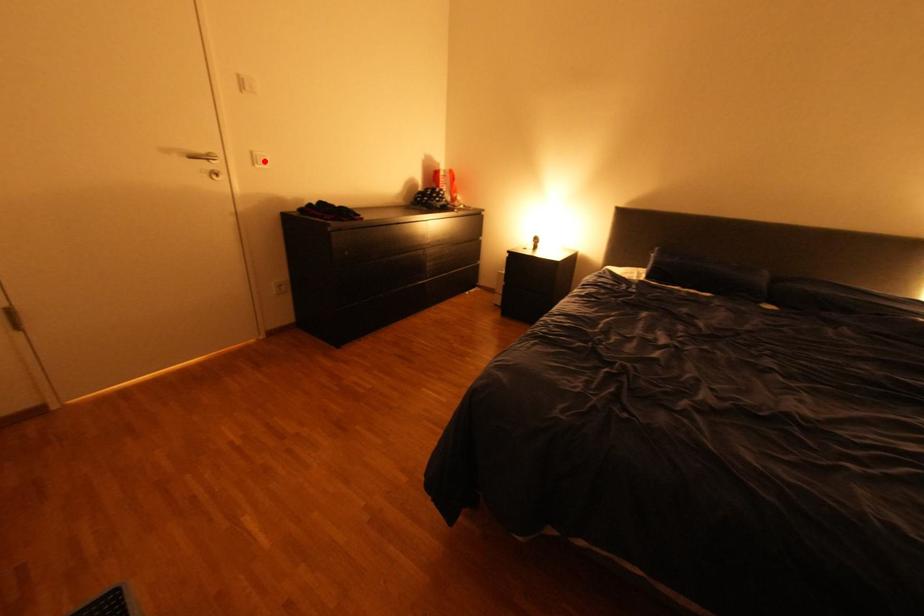
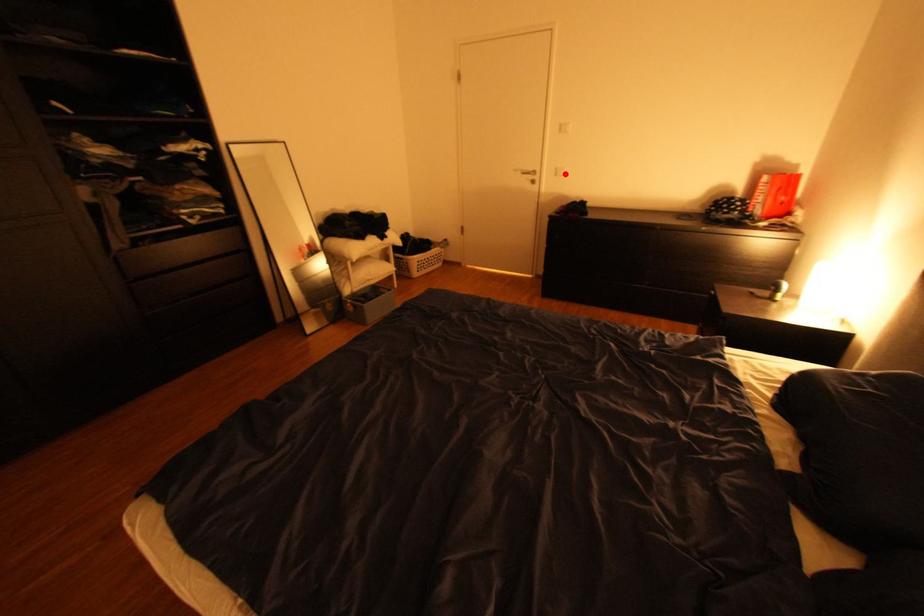
I am providing you with two images of the same scene from different viewpoints. A red point is marked on the first image and another point is marked on the second image. Is the marked point in image1 the same physical position as the marked point in image2?

Yes